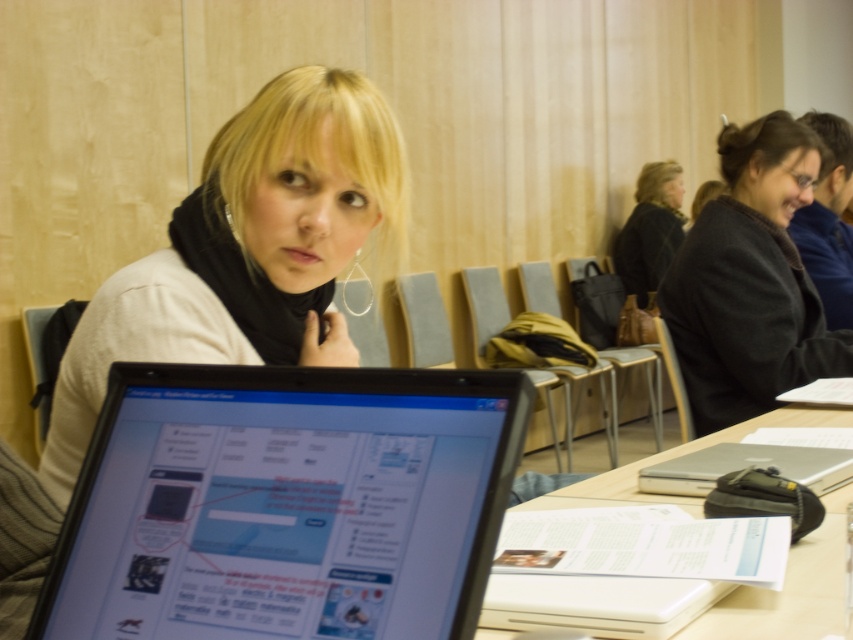
The woman in the image is wearing a matte black scarf at center. If you were to draw a point at coordinates (247, 250) on the image, where would it be located?

The point at coordinates (247, 250) corresponds to the matte black scarf at center.

You are standing in the classroom and see the point at coordinates [286,502]. Where is this point located?

The point at coordinates [286,502] is located on the shiny black laptop at center.